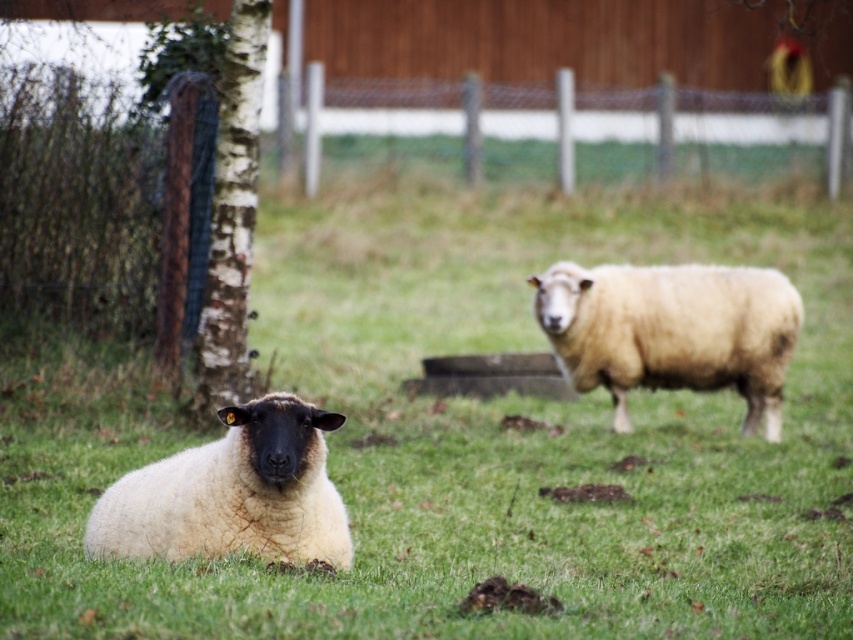
Question: Which of these objects is positioned farthest from the barky birch tree at left?

Choices:
 (A) green grassy at center
 (B) white woolly sheep at lower left

Answer: (B)

Question: Can you confirm if white wire mesh at center is positioned below barky birch tree at left?

Choices:
 (A) no
 (B) yes

Answer: (A)

Question: Is green grassy at center bigger than white woolly sheep at lower left?

Choices:
 (A) yes
 (B) no

Answer: (A)

Question: Considering the real-world distances, which object is closest to the green grassy at center?

Choices:
 (A) barky birch tree at left
 (B) white woolly sheep at center
 (C) white wire mesh at center
 (D) white woolly sheep at lower left

Answer: (B)

Question: Which of the following is the closest to the observer?

Choices:
 (A) white wire mesh at center
 (B) barky birch tree at left
 (C) green grassy at center
 (D) white woolly sheep at lower left

Answer: (C)

Question: Is green grassy at center below barky birch tree at left?

Choices:
 (A) yes
 (B) no

Answer: (A)